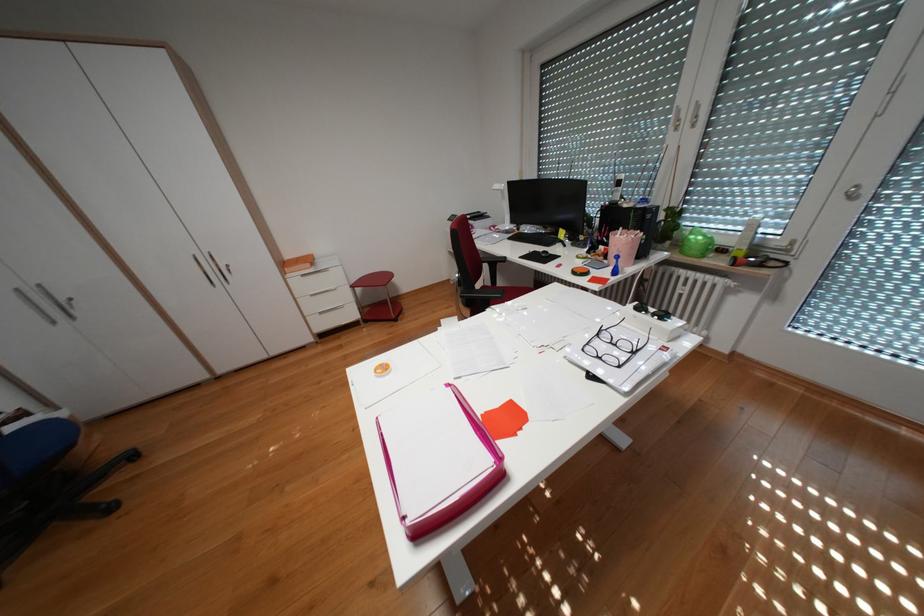
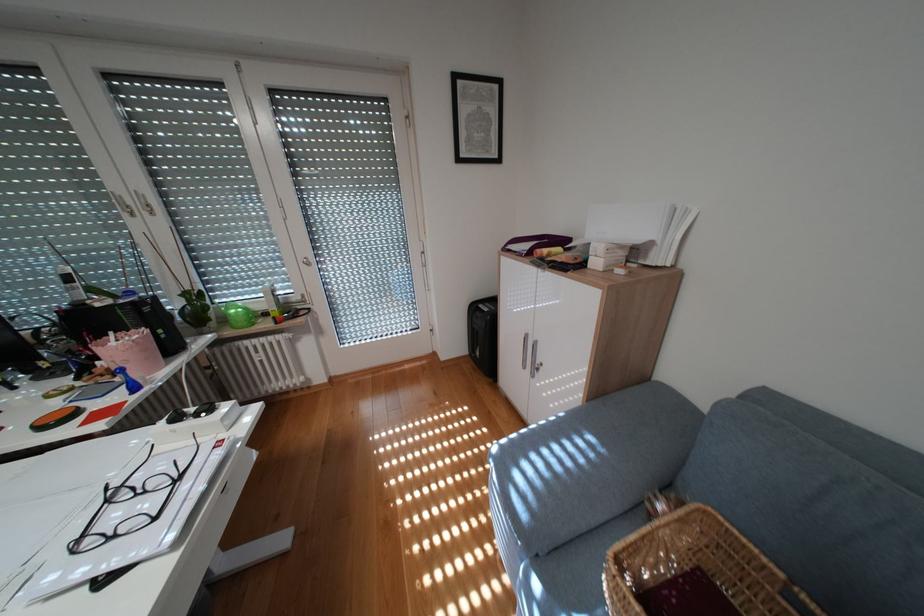
Question: How did the camera likely rotate?

Choices:
 (A) Left
 (B) Right
 (C) Up
 (D) Down

Answer: (B)